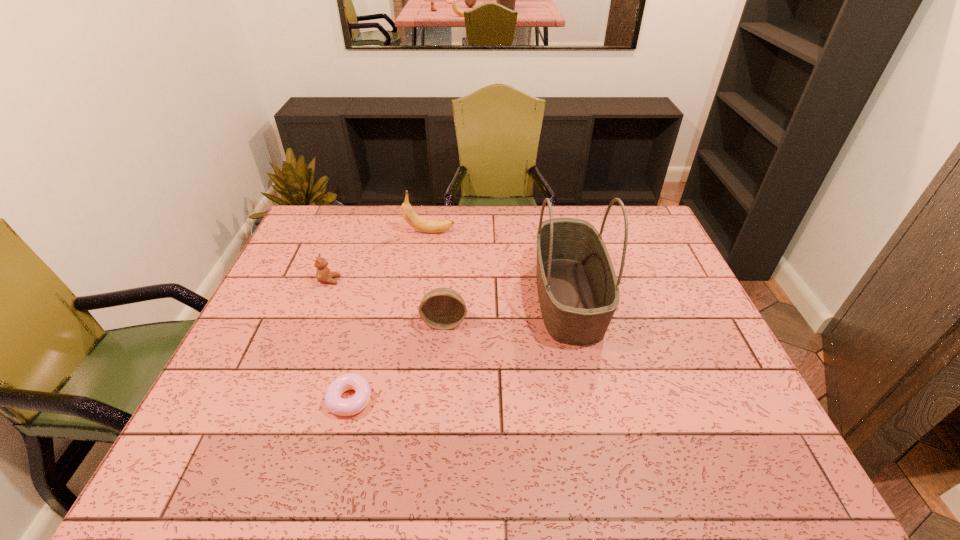
In order to click on the closest object relative to the basket in this screenshot , I will do `click(442, 308)`.

Identify which object is the fourth closest to the farthest object. Please provide its 2D coordinates. Your answer should be formatted as a tuple, i.e. [(x, y)], where the tuple contains the x and y coordinates of a point satisfying the conditions above.

[(333, 402)]

Image resolution: width=960 pixels, height=540 pixels. Identify the location of blank space that satisfies the following two spatial constraints: 1. at the start of the peel on the banana; 2. on the right side of the third tallest object. (416, 322).

Find the location of a particular element. This screenshot has width=960, height=540. vacant area that satisfies the following two spatial constraints: 1. at the start of the peel on the banana; 2. on the left side of the bowl is located at coordinates (416, 322).

The height and width of the screenshot is (540, 960). In order to click on free space that satisfies the following two spatial constraints: 1. on the face of the teddy bear; 2. on the left side of the shortest object in this screenshot , I will do `click(283, 400)`.

The height and width of the screenshot is (540, 960). Find the location of `vacant region that satisfies the following two spatial constraints: 1. at the start of the peel on the banana; 2. on the front side of the shortest object`. vacant region that satisfies the following two spatial constraints: 1. at the start of the peel on the banana; 2. on the front side of the shortest object is located at coordinates (404, 400).

Locate an element on the screen. vacant space that satisfies the following two spatial constraints: 1. on the face of the teddy bear; 2. on the back side of the nearest object is located at coordinates click(x=283, y=400).

The height and width of the screenshot is (540, 960). I want to click on free space that satisfies the following two spatial constraints: 1. on the face of the nearest object; 2. on the left side of the leftmost object, so click(283, 400).

This screenshot has height=540, width=960. What are the coordinates of `vacant area that satisfies the following two spatial constraints: 1. at the start of the peel on the second tallest object; 2. on the back side of the tallest object` in the screenshot? It's located at (420, 297).

In order to click on vacant point that satisfies the following two spatial constraints: 1. on the face of the leftmost object; 2. on the right side of the third tallest object in this screenshot , I will do `click(313, 322)`.